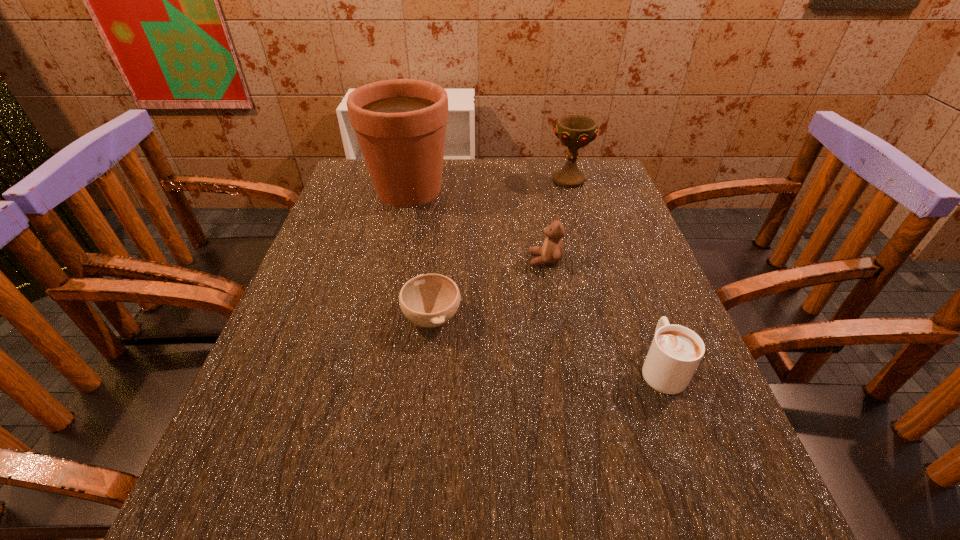
Where is `the tallest object`? The height and width of the screenshot is (540, 960). the tallest object is located at coordinates (400, 124).

The width and height of the screenshot is (960, 540). In order to click on chalice in this screenshot , I will do `click(574, 131)`.

At what (x,y) coordinates should I click in order to perform the action: click on teddy bear. Please return your answer as a coordinate pair (x, y). Looking at the image, I should click on pyautogui.click(x=552, y=251).

Locate an element on the screen. The image size is (960, 540). the third object from left to right is located at coordinates (552, 251).

The height and width of the screenshot is (540, 960). Find the location of `cappuccino`. cappuccino is located at coordinates (675, 352).

Locate an element on the screen. The height and width of the screenshot is (540, 960). bowl is located at coordinates (428, 300).

The height and width of the screenshot is (540, 960). In order to click on vacant area situated 0.180m on the front of the tallest object in this screenshot , I will do `click(394, 258)`.

Locate an element on the screen. This screenshot has height=540, width=960. free point located on the left of the chalice is located at coordinates (509, 180).

Where is `vacant region located on the front-facing side of the teddy bear`? This screenshot has width=960, height=540. vacant region located on the front-facing side of the teddy bear is located at coordinates pos(388,260).

Locate an element on the screen. The image size is (960, 540). vacant region located 0.120m on the front-facing side of the teddy bear is located at coordinates (478, 260).